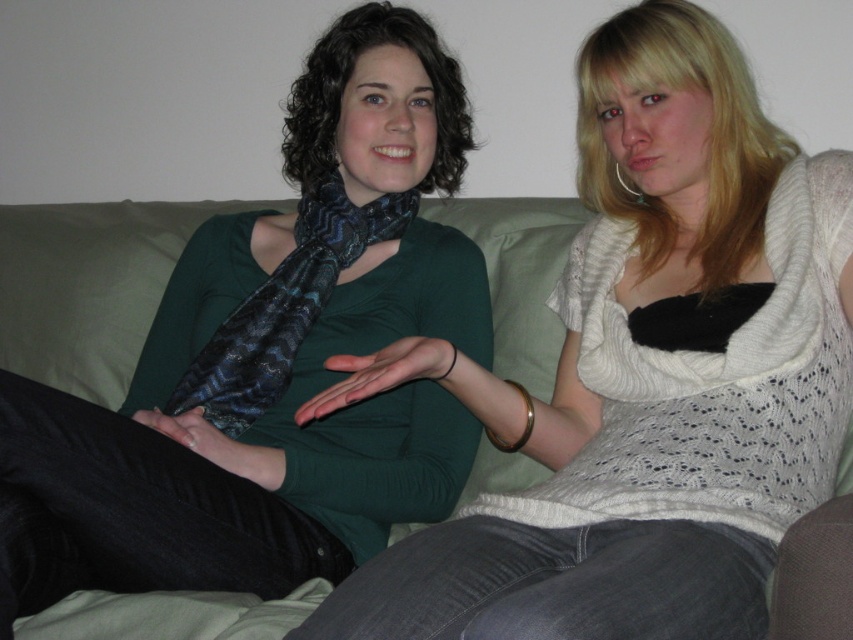
Between matte black scarf at center and shiny blue silk scarf at center, which one appears on the left side from the viewer's perspective?

shiny blue silk scarf at center

Consider the image. Does matte black scarf at center appear on the left side of shiny blue silk scarf at center?

No, matte black scarf at center is not to the left of shiny blue silk scarf at center.

Is point (245, 435) farther from camera compared to point (238, 321)?

No, it is not.

Locate an element on the screen. The height and width of the screenshot is (640, 853). matte black scarf at center is located at coordinates (242, 436).

Who is positioned more to the left, green fabric couch at center or shiny blue silk scarf at center?

Positioned to the left is green fabric couch at center.

The image size is (853, 640). What are the coordinates of `green fabric couch at center` in the screenshot? It's located at (91, 285).

Is point (148, 608) in front of point (225, 358)?

Yes, point (148, 608) is closer to viewer.

The width and height of the screenshot is (853, 640). Identify the location of green fabric couch at center. tap(91, 285).

Is matte black scarf at center taller than green fabric couch at center?

Yes.

Which is in front, point (451, 460) or point (102, 205)?

Point (451, 460) is in front.

At what (x,y) coordinates should I click in order to perform the action: click on matte black scarf at center. Please return your answer as a coordinate pair (x, y). The width and height of the screenshot is (853, 640). Looking at the image, I should click on (242, 436).